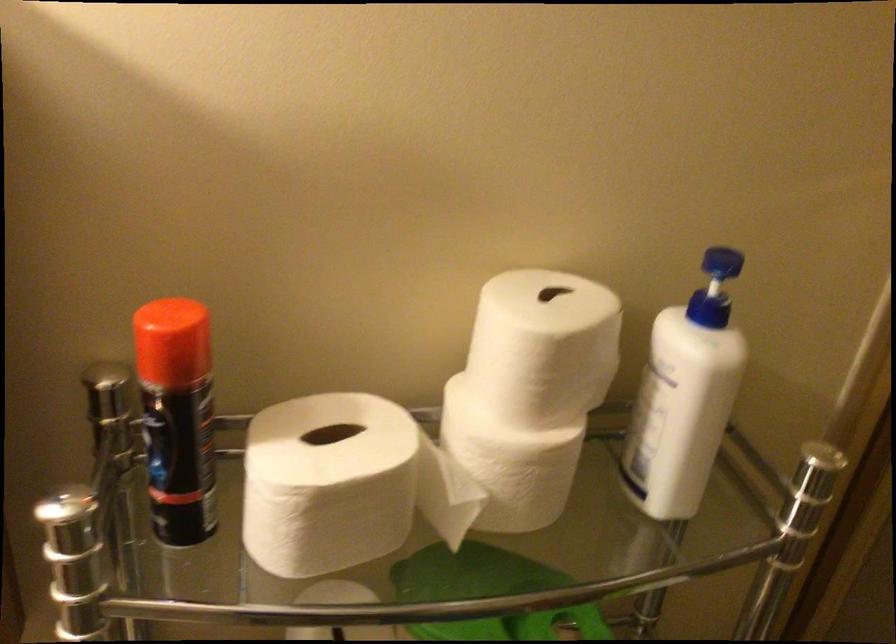
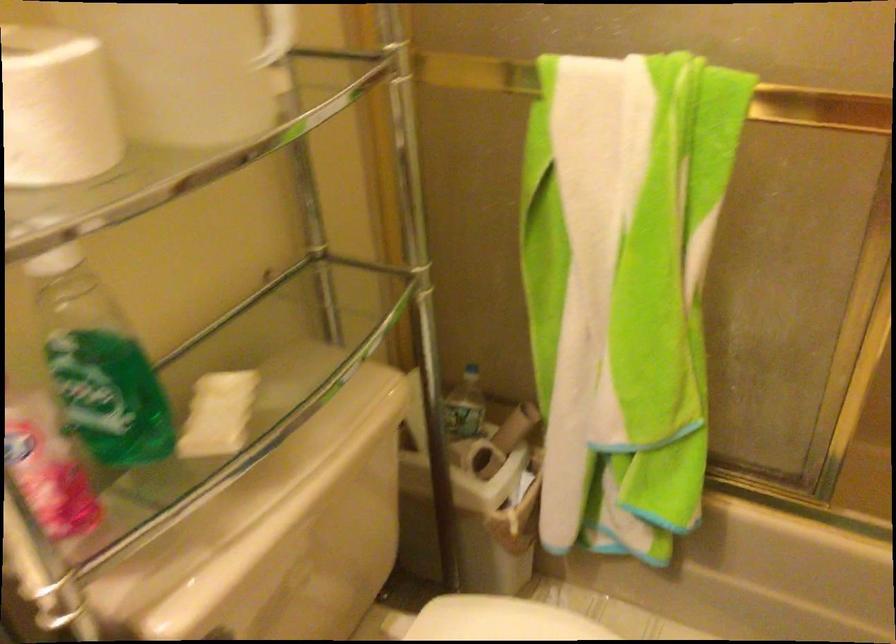
Question: The camera is either moving clockwise (left) or counter-clockwise (right) around the object. The first image is from the beginning of the video and the second image is from the end. Is the camera moving left or right when shooting the video?

Choices:
 (A) Left
 (B) Right

Answer: (A)